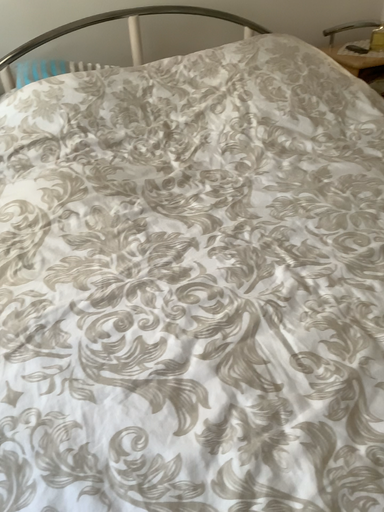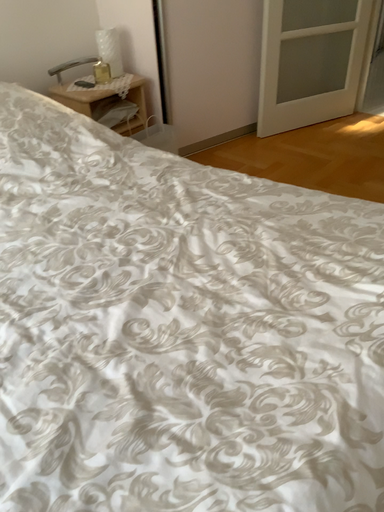
Question: Which way did the camera rotate in the video?

Choices:
 (A) rotated left
 (B) rotated right

Answer: (B)